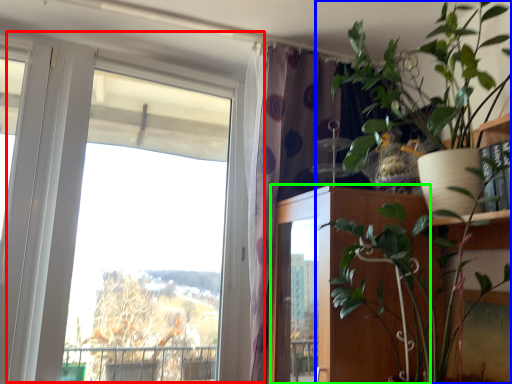
Question: Which object is positioned closest to window (highlighted by a red box)? Select from houseplant (highlighted by a blue box) and door (highlighted by a green box).

Choices:
 (A) houseplant
 (B) door

Answer: (B)